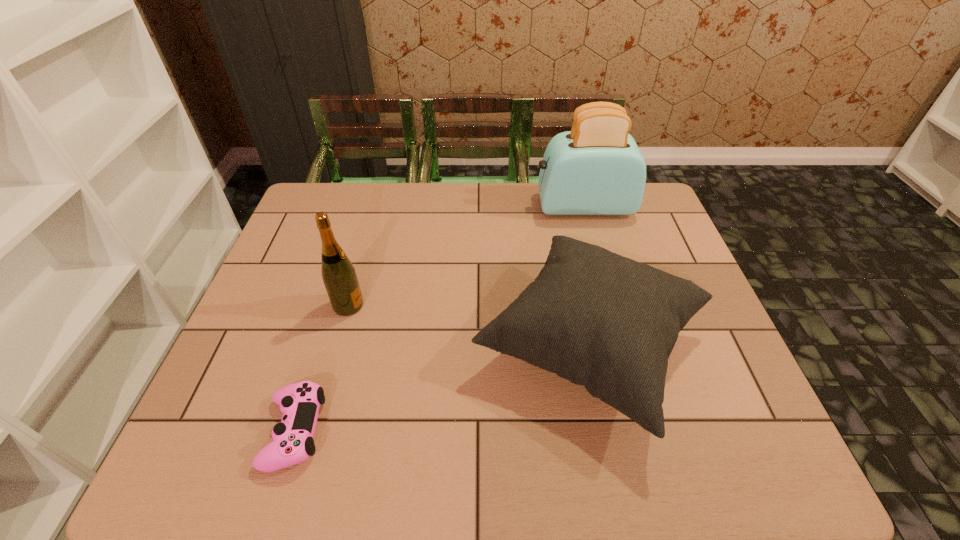
This screenshot has height=540, width=960. Find the location of `the farthest object`. the farthest object is located at coordinates (597, 168).

Where is `wine bottle`? This screenshot has height=540, width=960. wine bottle is located at coordinates (339, 276).

The width and height of the screenshot is (960, 540). I want to click on cushion, so click(601, 320).

The width and height of the screenshot is (960, 540). I want to click on control, so click(293, 443).

Find the location of a particular element. The image size is (960, 540). free space located on the side of the toaster with the lever is located at coordinates point(455,206).

The width and height of the screenshot is (960, 540). I want to click on vacant space positioned 0.150m on the side of the toaster with the lever, so [x=489, y=206].

This screenshot has height=540, width=960. In order to click on vacant region located 0.060m on the side of the toaster with the lever in this screenshot , I will do click(516, 206).

Find the location of a particular element. The image size is (960, 540). free point located on the front-facing side of the wine bottle is located at coordinates (473, 305).

At what (x,y) coordinates should I click in order to perform the action: click on free space located 0.250m on the left of the cushion. Please return your answer as a coordinate pair (x, y). Looking at the image, I should click on pos(366,347).

You are a GUI agent. You are given a task and a screenshot of the screen. Output one action in this format:
    pyautogui.click(x=<x>, y=<y>)
    Task: Click on the vacant space located 0.380m on the right of the shortest object
    Image resolution: width=960 pixels, height=540 pixels.
    Given the screenshot: What is the action you would take?
    pyautogui.click(x=513, y=431)